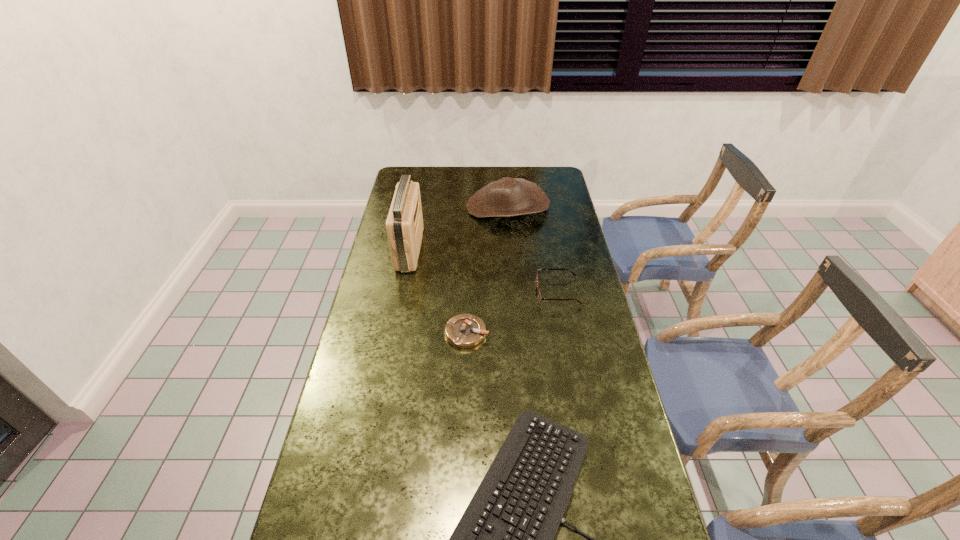
At what (x,y) coordinates should I click in order to perform the action: click on radio receiver. Please return your answer as a coordinate pair (x, y). Image resolution: width=960 pixels, height=540 pixels. Looking at the image, I should click on (404, 224).

Locate an element on the screen. The width and height of the screenshot is (960, 540). the leftmost object is located at coordinates (404, 224).

This screenshot has width=960, height=540. What are the coordinates of `the fourth shortest object` in the screenshot? It's located at (507, 197).

Where is `the third farthest object`? This screenshot has width=960, height=540. the third farthest object is located at coordinates (539, 296).

At what (x,y) coordinates should I click in order to perform the action: click on the third tallest object. Please return your answer as a coordinate pair (x, y). Looking at the image, I should click on (539, 296).

You are a GUI agent. You are given a task and a screenshot of the screen. Output one action in this format:
    pyautogui.click(x=<x>, y=<y>)
    Task: Click on the second nearest object
    
    Given the screenshot: What is the action you would take?
    tap(464, 330)

The image size is (960, 540). What are the coordinates of `ashtray` in the screenshot? It's located at (464, 330).

Identify the location of vacant point located on the front-facing side of the leftmost object. (444, 249).

The height and width of the screenshot is (540, 960). What are the coordinates of `vacant point located 0.300m on the front of the cowboy hat` in the screenshot? It's located at (514, 275).

Image resolution: width=960 pixels, height=540 pixels. Find the location of `free location located 0.190m on the lenses of the third shortest object`. free location located 0.190m on the lenses of the third shortest object is located at coordinates (483, 292).